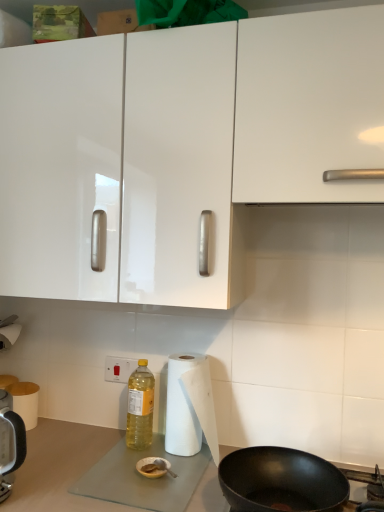
The image size is (384, 512). Describe the element at coordinates (280, 481) in the screenshot. I see `black matte frying pan at lower right` at that location.

In order to face white paper at lower center, the second paper towel positioned from the left, should I rotate leftwards or rightwards?

You should rotate right by 0.426 degrees.

Measure the distance between point (245, 138) and camera.

The distance of point (245, 138) from camera is 1.04 meters.

At what (x,y) coordinates should I click in order to perform the action: click on white plastic electric outlet at lower center. Please return your answer as a coordinate pair (x, y). Image resolution: width=384 pixels, height=512 pixels. Looking at the image, I should click on (119, 369).

Is white plastic electric outlet at lower center with white paper towel at lower left, the 2th paper towel in the front-to-back sequence?

No, white plastic electric outlet at lower center is not next to white paper towel at lower left, the 2th paper towel in the front-to-back sequence.

How many degrees apart are the facing directions of white plastic electric outlet at lower center and white paper towel at lower left, which is counted as the first paper towel, starting from the left?

They differ by 0.739 degrees in their facing directions.

How much distance is there between white plastic electric outlet at lower center and white paper towel at lower left, the 2th paper towel in the front-to-back sequence?

A distance of 11.50 inches exists between white plastic electric outlet at lower center and white paper towel at lower left, the 2th paper towel in the front-to-back sequence.

Between point (120, 380) and point (30, 396), which one is positioned behind?

Point (120, 380)

How far apart are white plastic electric outlet at lower center and white paper at lower center, which appears as the first paper towel when viewed from the right?

They are 9.97 inches apart.

From a real-world perspective, who is located lower, white plastic electric outlet at lower center or white paper at lower center, the 1th paper towel from the front?

From a 3D spatial view, white paper at lower center, the 1th paper towel from the front, is below.

Considering the relative sizes of white plastic electric outlet at lower center and white paper at lower center, the 1th paper towel from the front, in the image provided, is white plastic electric outlet at lower center bigger than white paper at lower center, the 1th paper towel from the front,?

No.

Which of these two, white plastic electric outlet at lower center or white paper at lower center, the 1th paper towel from the front, is thinner?

With smaller width is white plastic electric outlet at lower center.

Can you confirm if yellow translucent bottle at lower center is smaller than white glossy cabinet at upper center?

Yes, yellow translucent bottle at lower center is smaller than white glossy cabinet at upper center.

Is yellow translucent bottle at lower center inside or outside of white glossy cabinet at upper center?

yellow translucent bottle at lower center cannot be found inside white glossy cabinet at upper center.

From a real-world perspective, is yellow translucent bottle at lower center on white glossy cabinet at upper center?

Actually, yellow translucent bottle at lower center is physically below white glossy cabinet at upper center in the real world.

From the image's perspective, does white glossy cabinet at upper center appear lower than white paper at lower center, the second paper towel positioned from the left?

No, from the image's perspective, white glossy cabinet at upper center is not beneath white paper at lower center, the second paper towel positioned from the left.

Relative to white paper at lower center, the second paper towel positioned from the left, is white glossy cabinet at upper center in front or behind?

Clearly, white glossy cabinet at upper center is in front of white paper at lower center, the second paper towel positioned from the left.

Which of these two, white glossy cabinet at upper center or white paper at lower center, the second paper towel positioned from the left, stands shorter?

white paper at lower center, the second paper towel positioned from the left.

Which point is more forward, (376,16) or (192,430)?

The point (376,16) is closer.

From a real-world perspective, which object stands above the other?

black matte frying pan at lower right, from a real-world perspective.

Is white paper towel at lower left, which is counted as the first paper towel, starting from the left, at the right side of black matte frying pan at lower right?

No, white paper towel at lower left, which is counted as the first paper towel, starting from the left, is not to the right of black matte frying pan at lower right.

Can you confirm if white paper towel at lower left, arranged as the 2th paper towel when viewed from the right, is wider than black matte frying pan at lower right?

Incorrect, the width of white paper towel at lower left, arranged as the 2th paper towel when viewed from the right, does not surpass that of black matte frying pan at lower right.

From the image's perspective, is white paper towel at lower left, the 1th paper towel viewed from the back, above or below black matte frying pan at lower right?

Based on their image positions, white paper towel at lower left, the 1th paper towel viewed from the back, is located above black matte frying pan at lower right.

Is black matte frying pan at lower right located within white glossy cabinet at upper center?

Actually, black matte frying pan at lower right is outside white glossy cabinet at upper center.

Is white glossy cabinet at upper center oriented away from black matte frying pan at lower right?

white glossy cabinet at upper center does not have its back to black matte frying pan at lower right.

In the scene shown: Is white glossy cabinet at upper center to the left or to the right of black matte frying pan at lower right in the image?

Based on their positions, white glossy cabinet at upper center is located to the left of black matte frying pan at lower right.

From a real-world perspective, is white glossy cabinet at upper center over black matte frying pan at lower right?

Yes, from a real-world perspective, white glossy cabinet at upper center is on top of black matte frying pan at lower right.

Is white plastic electric outlet at lower center aimed at yellow translucent bottle at lower center?

Yes, white plastic electric outlet at lower center is facing yellow translucent bottle at lower center.

Would you say white plastic electric outlet at lower center is to the left or to the right of yellow translucent bottle at lower center in the picture?

white plastic electric outlet at lower center is positioned on yellow translucent bottle at lower center's left side.

In terms of height, does white plastic electric outlet at lower center look taller or shorter compared to yellow translucent bottle at lower center?

Clearly, white plastic electric outlet at lower center is shorter compared to yellow translucent bottle at lower center.

You are a GUI agent. You are given a task and a screenshot of the screen. Output one action in this format:
    pyautogui.click(x=<x>, y=<y>)
    Task: Click on the paper towel on the left of white plastic electric outlet at lower center
    
    Given the screenshot: What is the action you would take?
    pyautogui.click(x=25, y=402)

From the image's perspective, count 1st paper towels downward from the white plastic electric outlet at lower center and point to it. Please provide its 2D coordinates.

[(190, 406)]

Based on their spatial positions, is white plastic electric outlet at lower center or white paper at lower center, the second paper towel positioned from the left, closer to black matte frying pan at lower right?

white paper at lower center, the second paper towel positioned from the left, is positioned closer to the anchor black matte frying pan at lower right.

Estimate the real-world distances between objects in this image. Which object is closer to white plastic electric outlet at lower center, white glossy cabinet at upper center or white paper at lower center, which appears as the first paper towel when viewed from the right?

white paper at lower center, which appears as the first paper towel when viewed from the right, lies closer to white plastic electric outlet at lower center than the other object.

Based on their spatial positions, is white paper at lower center, the 1th paper towel from the front, or yellow translucent bottle at lower center further from black matte frying pan at lower right?

Among the two, yellow translucent bottle at lower center is located further to black matte frying pan at lower right.

From the image, which object appears to be farther from white paper towel at lower left, arranged as the 2th paper towel when viewed from the right, white plastic electric outlet at lower center or white glossy cabinet at upper center?

white glossy cabinet at upper center lies further to white paper towel at lower left, arranged as the 2th paper towel when viewed from the right, than the other object.

Considering their positions, is black matte frying pan at lower right positioned further to yellow translucent bottle at lower center than white glossy cabinet at upper center?

The object further to yellow translucent bottle at lower center is white glossy cabinet at upper center.

When comparing their distances from white paper towel at lower left, the 1th paper towel viewed from the back, does white plastic electric outlet at lower center or yellow translucent bottle at lower center seem closer?

The object closer to white paper towel at lower left, the 1th paper towel viewed from the back, is white plastic electric outlet at lower center.

From the picture: From the image, which object appears to be nearer to black matte frying pan at lower right, yellow translucent bottle at lower center or white paper at lower center, the 2th paper towel viewed from the back?

white paper at lower center, the 2th paper towel viewed from the back, is closer to black matte frying pan at lower right.

Based on their spatial positions, is white glossy cabinet at upper center or black matte frying pan at lower right further from white paper at lower center, the 2th paper towel viewed from the back?

white glossy cabinet at upper center is positioned further to the anchor white paper at lower center, the 2th paper towel viewed from the back.

Image resolution: width=384 pixels, height=512 pixels. Find the location of `electric outlet between white glossy cabinet at upper center and white paper at lower center, the 2th paper towel viewed from the back, from top to bottom`. electric outlet between white glossy cabinet at upper center and white paper at lower center, the 2th paper towel viewed from the back, from top to bottom is located at coordinates pyautogui.click(x=119, y=369).

Where is `electric outlet between white glossy cabinet at upper center and white paper towel at lower left, the 1th paper towel viewed from the back, vertically`? electric outlet between white glossy cabinet at upper center and white paper towel at lower left, the 1th paper towel viewed from the back, vertically is located at coordinates (119, 369).

Where is `bottle between white paper towel at lower left, which is counted as the first paper towel, starting from the left, and black matte frying pan at lower right, in the horizontal direction`? bottle between white paper towel at lower left, which is counted as the first paper towel, starting from the left, and black matte frying pan at lower right, in the horizontal direction is located at coordinates (140, 407).

Find the location of a particular element. electric outlet between white glossy cabinet at upper center and yellow translucent bottle at lower center in the vertical direction is located at coordinates (119, 369).